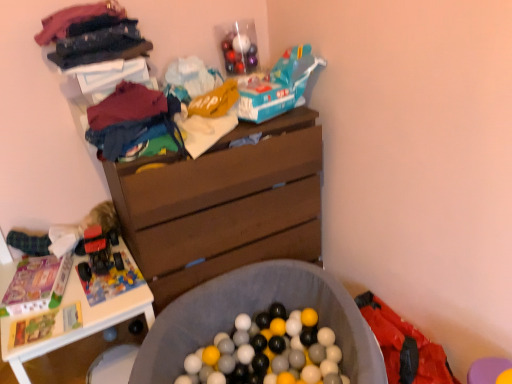
Question: From a real-world perspective, is matte cotton t-shirt at upper left, which ranks as the 2th clothing in top-to-bottom order, over red fabric underclothes at lower right?

Choices:
 (A) yes
 (B) no

Answer: (A)

Question: Does matte cotton t-shirt at upper left, the 1th clothing positioned from the bottom, have a smaller size compared to red fabric underclothes at lower right?

Choices:
 (A) no
 (B) yes

Answer: (B)

Question: Does matte cotton t-shirt at upper left, which ranks as the 2th clothing in top-to-bottom order, have a lesser width compared to red fabric underclothes at lower right?

Choices:
 (A) no
 (B) yes

Answer: (B)

Question: From the image's perspective, does matte cotton t-shirt at upper left, which ranks as the 2th clothing in top-to-bottom order, appear higher than red fabric underclothes at lower right?

Choices:
 (A) yes
 (B) no

Answer: (A)

Question: Is matte cotton t-shirt at upper left, which ranks as the 2th clothing in top-to-bottom order, further to the viewer compared to red fabric underclothes at lower right?

Choices:
 (A) no
 (B) yes

Answer: (B)

Question: Considering their positions, is matte cotton t-shirt at upper left, which ranks as the 2th clothing in top-to-bottom order, located in front of or behind teal plastic toy car at upper center, placed as the first toy car when sorted from top to bottom?

Choices:
 (A) behind
 (B) front

Answer: (B)

Question: Looking at their shapes, would you say matte cotton t-shirt at upper left, the 1th clothing positioned from the bottom, is wider or thinner than teal plastic toy car at upper center, placed as the first toy car when sorted from top to bottom?

Choices:
 (A) thin
 (B) wide

Answer: (A)

Question: From the image's perspective, is matte cotton t-shirt at upper left, which ranks as the 2th clothing in top-to-bottom order, above or below teal plastic toy car at upper center, arranged as the 1th toy car when viewed from the right?

Choices:
 (A) above
 (B) below

Answer: (B)

Question: Is point (102, 107) positioned closer to the camera than point (301, 77)?

Choices:
 (A) farther
 (B) closer

Answer: (B)

Question: Considering the relative positions of brown wood chest of drawers at center and soft gray fabric ball pit at center in the image provided, is brown wood chest of drawers at center to the left or to the right of soft gray fabric ball pit at center?

Choices:
 (A) left
 (B) right

Answer: (A)

Question: From the image's perspective, is brown wood chest of drawers at center positioned above or below soft gray fabric ball pit at center?

Choices:
 (A) above
 (B) below

Answer: (A)

Question: Is brown wood chest of drawers at center taller or shorter than soft gray fabric ball pit at center?

Choices:
 (A) tall
 (B) short

Answer: (A)

Question: Is brown wood chest of drawers at center wider or thinner than soft gray fabric ball pit at center?

Choices:
 (A) thin
 (B) wide

Answer: (A)

Question: Is white plastic table at lower left taller or shorter than soft gray fabric ball pit at center?

Choices:
 (A) short
 (B) tall

Answer: (B)

Question: In terms of size, does white plastic table at lower left appear bigger or smaller than soft gray fabric ball pit at center?

Choices:
 (A) small
 (B) big

Answer: (A)